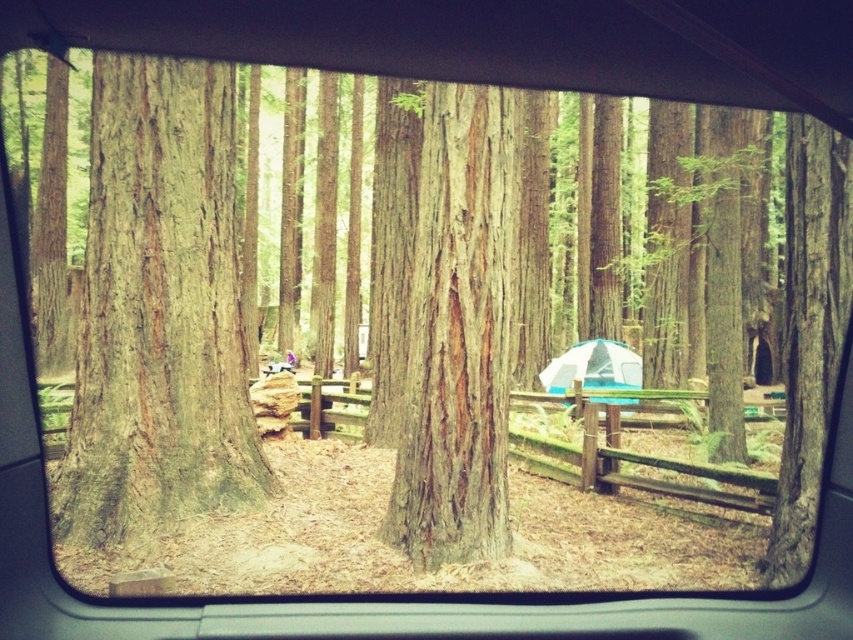
Question: Which of these objects is positioned farthest from the smooth gray bark at center?

Choices:
 (A) smooth brown tree trunk at center
 (B) white fabric tent at center

Answer: (B)

Question: Is smooth gray bark at center to the left of white fabric tent at center from the viewer's perspective?

Choices:
 (A) yes
 (B) no

Answer: (A)

Question: Among these points, which one is farthest from the camera?

Choices:
 (A) (407, 490)
 (B) (564, 376)
 (C) (166, 387)

Answer: (B)

Question: Does smooth brown tree trunk at center appear under white fabric tent at center?

Choices:
 (A) no
 (B) yes

Answer: (A)

Question: Observing the image, what is the correct spatial positioning of smooth brown tree trunk at center in reference to white fabric tent at center?

Choices:
 (A) below
 (B) above

Answer: (B)

Question: Which object appears farthest from the camera in this image?

Choices:
 (A) smooth gray bark at center
 (B) smooth brown tree trunk at center
 (C) white fabric tent at center

Answer: (C)